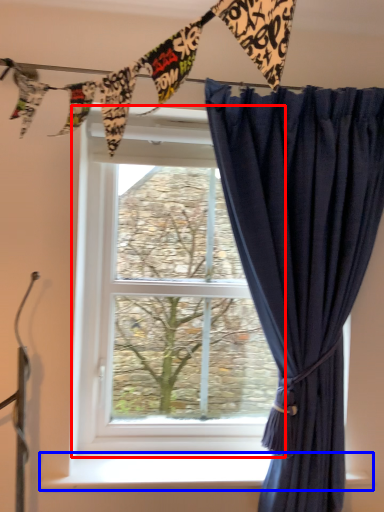
Question: Which object is further to the camera taking this photo, window (highlighted by a red box) or window sill (highlighted by a blue box)?

Choices:
 (A) window
 (B) window sill

Answer: (A)